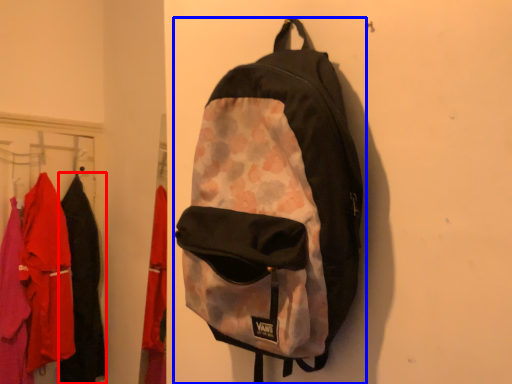
Question: Which of the following is the farthest to the observer, clothing (highlighted by a red box) or backpack (highlighted by a blue box)?

Choices:
 (A) clothing
 (B) backpack

Answer: (A)